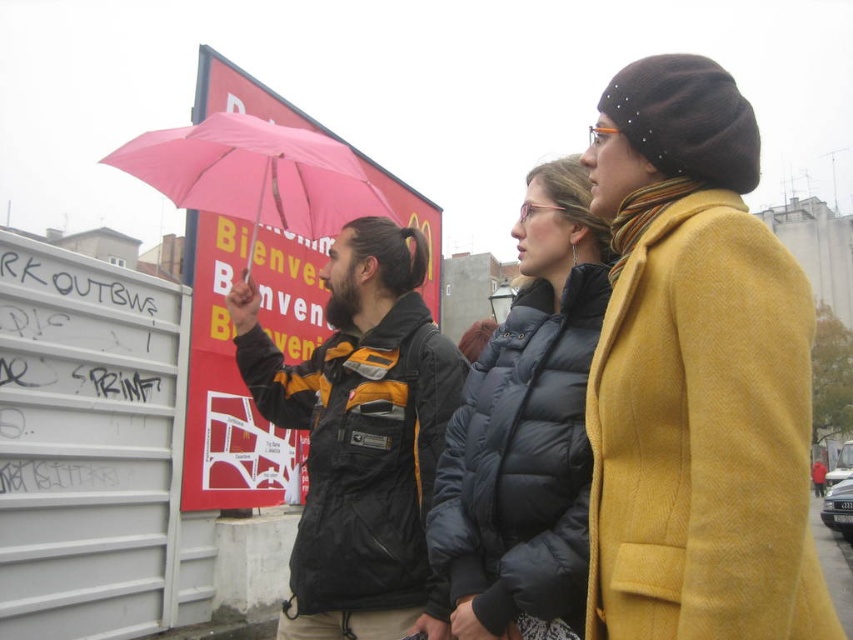
Can you confirm if matte black puffer jacket at center is positioned above pink matte umbrella at upper center?

No.

Between matte black puffer jacket at center and pink matte umbrella at upper center, which one has less height?

pink matte umbrella at upper center

Find the location of a particular element. The width and height of the screenshot is (853, 640). matte black puffer jacket at center is located at coordinates (526, 428).

Does mustard woolen coat at right have a smaller size compared to matte black puffer jacket at center?

Yes.

Is mustard woolen coat at right to the right of matte black puffer jacket at center from the viewer's perspective?

Indeed, mustard woolen coat at right is positioned on the right side of matte black puffer jacket at center.

Who is more forward, (618,579) or (521,422)?

Point (618,579)

Identify the location of mustard woolen coat at right. (701, 429).

Who is lower down, black and yellow jacket at center or matte black puffer jacket at center?

black and yellow jacket at center

Which is behind, point (315, 630) or point (581, 460)?

Point (315, 630)

You are a GUI agent. You are given a task and a screenshot of the screen. Output one action in this format:
    pyautogui.click(x=<x>, y=<y>)
    Task: Click on the black and yellow jacket at center
    The width and height of the screenshot is (853, 640).
    Given the screenshot: What is the action you would take?
    pyautogui.click(x=361, y=436)